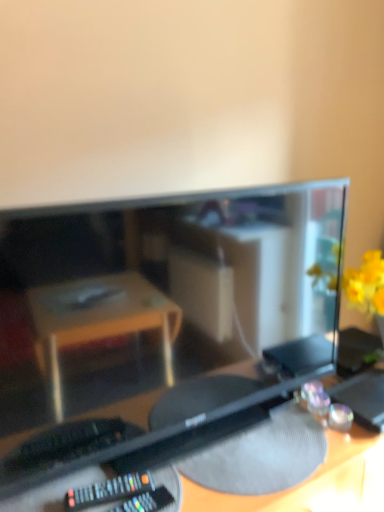
The height and width of the screenshot is (512, 384). I want to click on blank space situated above black plastic desk at center (from a real-world perspective), so click(270, 446).